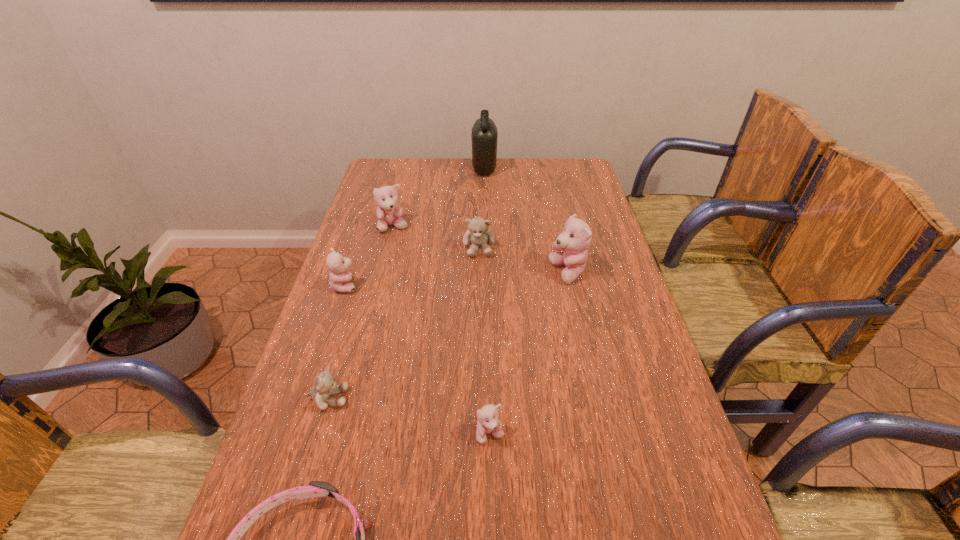
Image resolution: width=960 pixels, height=540 pixels. I want to click on the second nearest object, so click(488, 423).

Find the location of a particular element. This screenshot has height=540, width=960. the third nearest object is located at coordinates (324, 386).

You are a GUI agent. You are given a task and a screenshot of the screen. Output one action in this format:
    pyautogui.click(x=<x>, y=<y>)
    Task: Click on the nearer gray teddy bear
    The image size is (960, 540).
    Given the screenshot: What is the action you would take?
    point(324,386)

Where is `blank space located 0.260m on the right of the farthest object`? This screenshot has width=960, height=540. blank space located 0.260m on the right of the farthest object is located at coordinates (563, 170).

At what (x,y) coordinates should I click in order to perform the action: click on free space located 0.140m at the face of the rightmost object. Please return your answer as a coordinate pair (x, y). This screenshot has width=960, height=540. Looking at the image, I should click on (501, 273).

This screenshot has height=540, width=960. In order to click on vacant space located at the face of the rightmost object in this screenshot , I will do `click(446, 273)`.

Locate an element on the screen. The height and width of the screenshot is (540, 960). free space located 0.070m at the face of the rightmost object is located at coordinates (525, 273).

Where is `free location located 0.190m at the face of the second pink teddy bear from left to right`? The image size is (960, 540). free location located 0.190m at the face of the second pink teddy bear from left to right is located at coordinates (381, 274).

Find the location of a particular element. vacant space located 0.290m at the face of the second smallest pink teddy bear is located at coordinates (461, 286).

This screenshot has height=540, width=960. Identify the location of free region located 0.260m on the face of the right gray teddy bear. (479, 325).